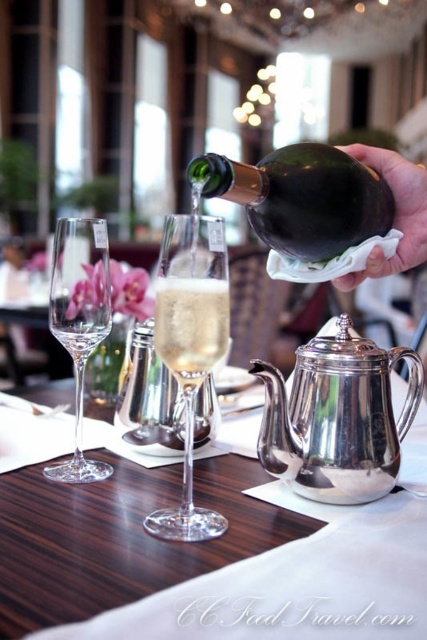
Question: Is silver metallic teapot at center to the right of green glass bottle at upper center from the viewer's perspective?

Choices:
 (A) yes
 (B) no

Answer: (B)

Question: Which object appears farthest from the camera in this image?

Choices:
 (A) silver/metallic teapot at center
 (B) silver metallic teapot at center
 (C) green glass bottle at upper center
 (D) clear glass wine glass at center

Answer: (A)

Question: Does clear glass wine glass at center lie in front of clear glass wine glass at left?

Choices:
 (A) no
 (B) yes

Answer: (B)

Question: Is green glass bottle at upper center in front of clear glass champagne at center?

Choices:
 (A) yes
 (B) no

Answer: (A)

Question: Which is nearer to the silver/metallic teapot at center?

Choices:
 (A) clear glass wine glass at center
 (B) clear glass champagne at center
 (C) green glass bottle at upper center
 (D) silver metallic teapot at center

Answer: (D)

Question: Which point is farther from the camera taking this photo?

Choices:
 (A) (154, 317)
 (B) (70, 282)

Answer: (B)